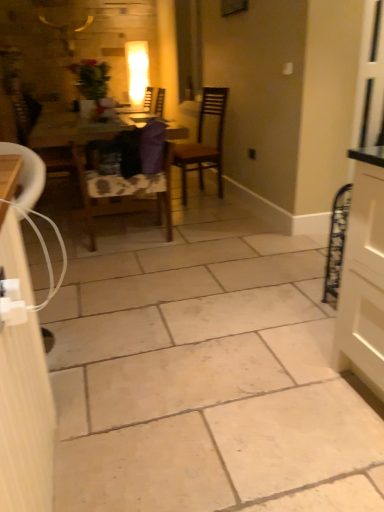
You are a GUI agent. You are given a task and a screenshot of the screen. Output one action in this format:
    pyautogui.click(x=<x>, y=<y>)
    Task: Click on the free space in front of brown wooden chair at center, which is counted as the 1th chair, starting from the right
    
    Given the screenshot: What is the action you would take?
    pyautogui.click(x=208, y=208)